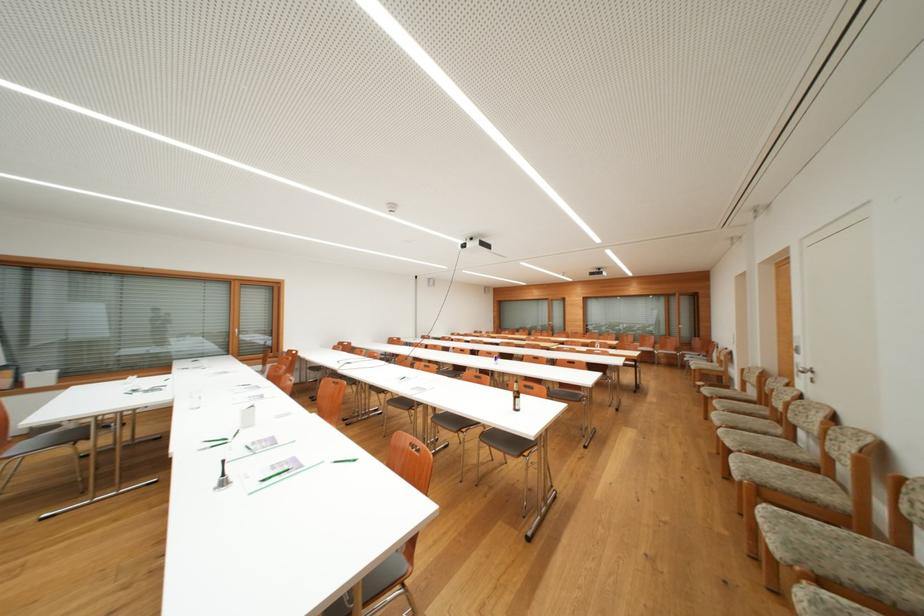
Which object does [516,397] point to?

It corresponds to the brown glass bottle in the image.